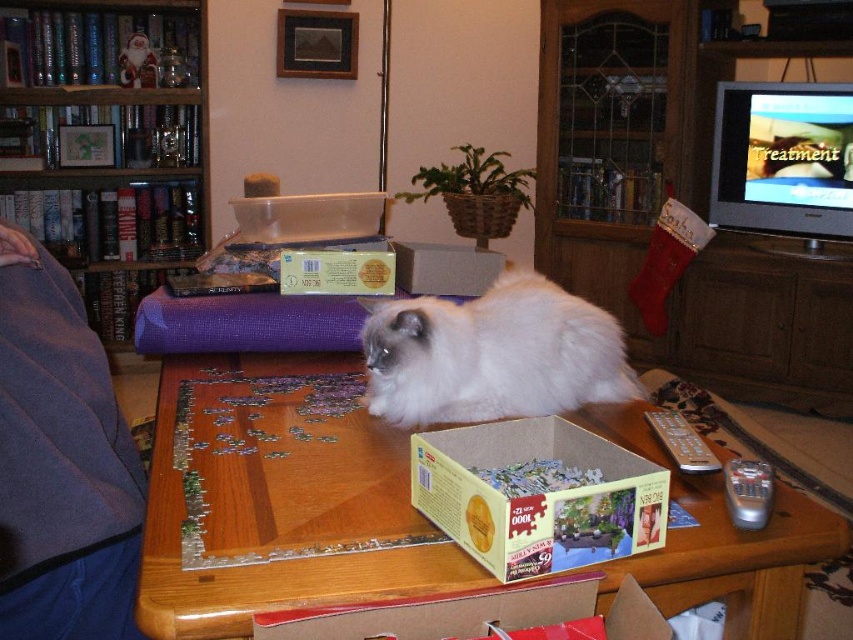
Between wooden table at center and white fluffy cat at center, which one is positioned higher?

Positioned higher is white fluffy cat at center.

Which is in front, point (405, 556) or point (460, 392)?

Positioned in front is point (405, 556).

Is point (274, 508) behind point (408, 307)?

No.

At what (x,y) coordinates should I click in order to perform the action: click on wooden table at center. Please return your answer as a coordinate pair (x, y). Image resolution: width=853 pixels, height=640 pixels. Looking at the image, I should click on (279, 496).

Does wooden bookshelf at upper left appear on the left side of cardboard puzzle box at center?

Answer: Indeed, wooden bookshelf at upper left is positioned on the left side of cardboard puzzle box at center.

Image resolution: width=853 pixels, height=640 pixels. In order to click on wooden bookshelf at upper left in this screenshot , I will do `click(106, 141)`.

Locate an element on the screen. The image size is (853, 640). wooden bookshelf at upper left is located at coordinates (106, 141).

Is the position of white fluffy cat at center less distant than that of cardboard puzzle box at center?

That is False.

Between point (569, 390) and point (503, 472), which one is positioned in front?

Point (503, 472)

What do you see at coordinates (492, 355) in the screenshot? I see `white fluffy cat at center` at bounding box center [492, 355].

At what (x,y) coordinates should I click in order to perform the action: click on white fluffy cat at center. Please return your answer as a coordinate pair (x, y). The height and width of the screenshot is (640, 853). Looking at the image, I should click on (492, 355).